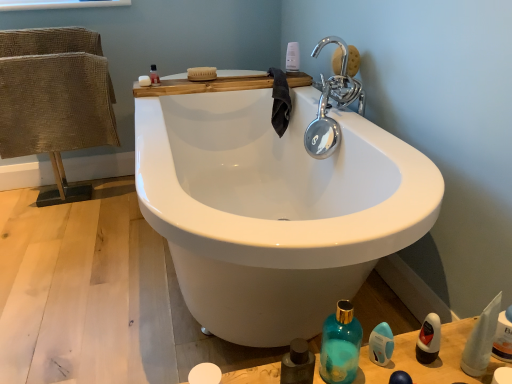
Locate an element on the screen. The image size is (512, 384). vacant space that's between white fabric towel at lower right, the second toiletry in the top-to-bottom sequence, and teal glass bottle at lower right is located at coordinates (411, 366).